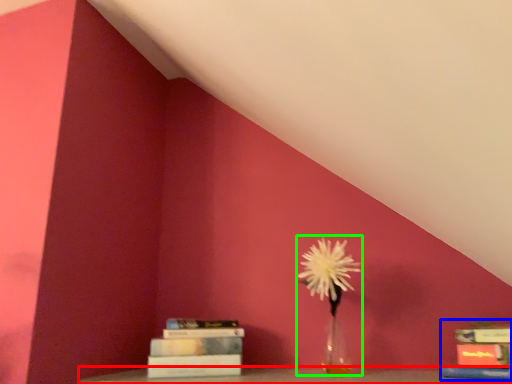
Question: Which is farther away from furniture (highlighted by a red box)? book (highlighted by a blue box) or floral arrangement (highlighted by a green box)?

Choices:
 (A) book
 (B) floral arrangement

Answer: (B)